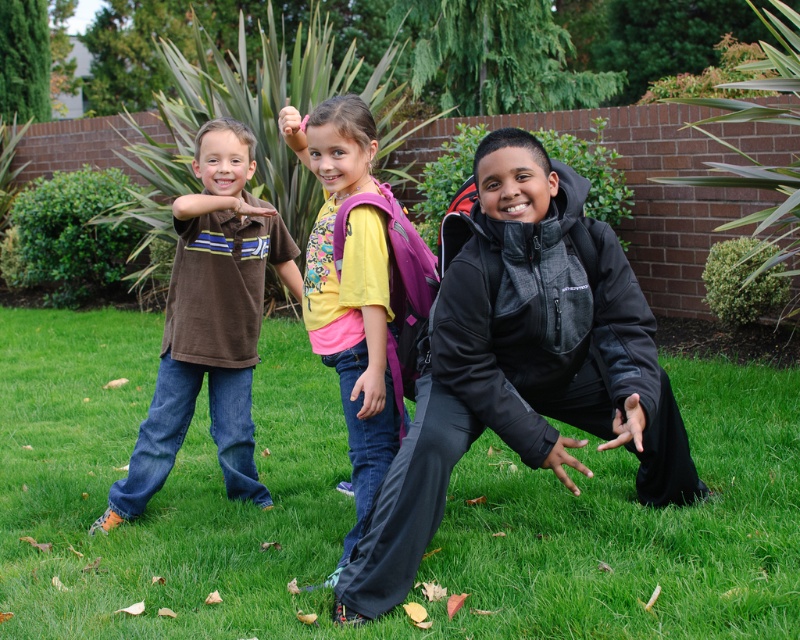
You are a photographer standing 3 meters away from the children. You want to take a photo of the green grass at center and the black softshell jacket at center. Can you fit both of them in your camera frame which has a maximum width of 2 meters?

The green grass at center and black softshell jacket at center are 2.10 meters apart from each other. Since the maximum width of the camera frame is 2 meters, the photographer cannot fit both objects in the frame as the distance between them exceeds the frame width.

You are a photographer trying to capture a photo of the children. You want to ensure that the black softshell jacket at center and the brown cotton shirt at left are both visible in the frame. Based on their positions, which item is closer to the bottom of the image?

The black softshell jacket at center is located below the brown cotton shirt at left, so it is closer to the bottom of the image.